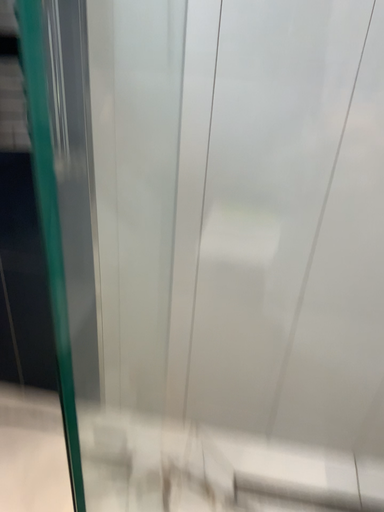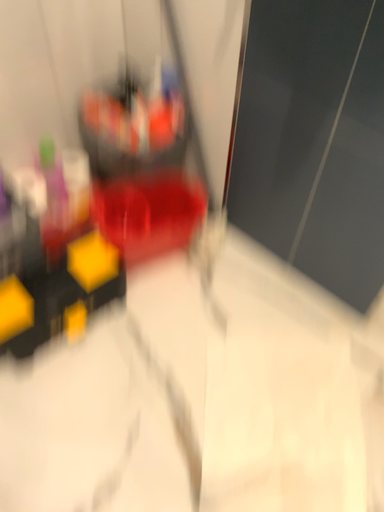
Question: How did the camera likely rotate when shooting the video?

Choices:
 (A) rotated left
 (B) rotated right

Answer: (A)